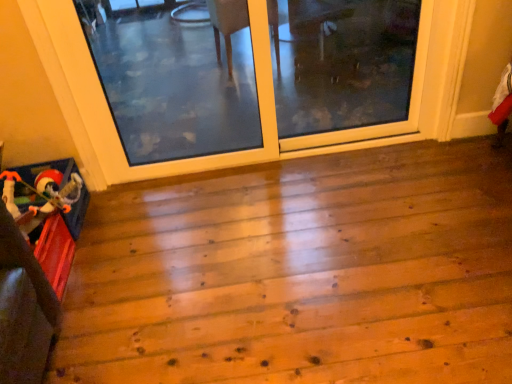
Question: From a real-world perspective, does wooden toy at lower left stand above clear glass screen door at center, which is counted as the second screen door, starting from the right?

Choices:
 (A) yes
 (B) no

Answer: (B)

Question: Considering the relative positions of wooden toy at lower left and clear glass screen door at center, which is counted as the second screen door, starting from the right, in the image provided, is wooden toy at lower left behind clear glass screen door at center, which is counted as the second screen door, starting from the right,?

Choices:
 (A) yes
 (B) no

Answer: (B)

Question: Can you confirm if wooden toy at lower left is positioned to the right of clear glass screen door at center, which is counted as the second screen door, starting from the right?

Choices:
 (A) yes
 (B) no

Answer: (B)

Question: Is wooden toy at lower left turned away from clear glass screen door at center, the 1th screen door when ordered from left to right?

Choices:
 (A) yes
 (B) no

Answer: (B)

Question: Does wooden toy at lower left have a greater height compared to clear glass screen door at center, the 1th screen door when ordered from left to right?

Choices:
 (A) no
 (B) yes

Answer: (A)

Question: In terms of height, does wooden toy at lower left look taller or shorter compared to plush santa toy at lower left?

Choices:
 (A) short
 (B) tall

Answer: (A)

Question: Is point tap(37, 342) closer or farther from the camera than point tap(58, 183)?

Choices:
 (A) farther
 (B) closer

Answer: (B)

Question: From the image's perspective, is wooden toy at lower left above or below plush santa toy at lower left?

Choices:
 (A) above
 (B) below

Answer: (B)

Question: Is wooden toy at lower left inside the boundaries of plush santa toy at lower left, or outside?

Choices:
 (A) inside
 (B) outside

Answer: (B)

Question: Is point (54, 196) closer or farther from the camera than point (421, 54)?

Choices:
 (A) closer
 (B) farther

Answer: (A)

Question: Visually, is plush santa toy at lower left positioned to the left or to the right of transparent glass screen door at upper center, which is the first screen door in right-to-left order?

Choices:
 (A) left
 (B) right

Answer: (A)

Question: In terms of height, does plush santa toy at lower left look taller or shorter compared to transparent glass screen door at upper center, which is the first screen door in right-to-left order?

Choices:
 (A) short
 (B) tall

Answer: (A)

Question: Looking at their shapes, would you say plush santa toy at lower left is wider or thinner than transparent glass screen door at upper center, which is the first screen door in right-to-left order?

Choices:
 (A) wide
 (B) thin

Answer: (A)

Question: Would you say clear glass screen door at center, the 1th screen door when ordered from left to right, is inside or outside transparent glass screen door at upper center, placed as the second screen door when sorted from left to right?

Choices:
 (A) inside
 (B) outside

Answer: (B)

Question: Is point (74, 67) positioned closer to the camera than point (413, 104)?

Choices:
 (A) closer
 (B) farther

Answer: (A)